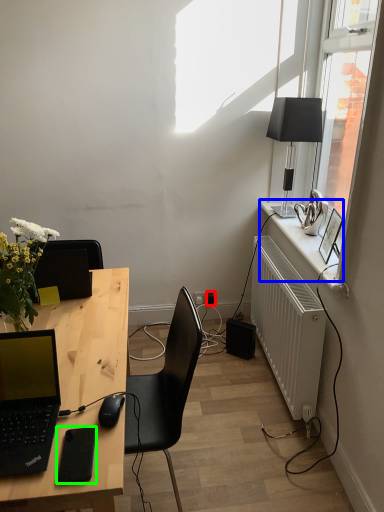
Question: Considering the real-world distances, which object is closest to power outlet (highlighted by a red box)? window sill (highlighted by a blue box) or gadget (highlighted by a green box).

Choices:
 (A) window sill
 (B) gadget

Answer: (A)